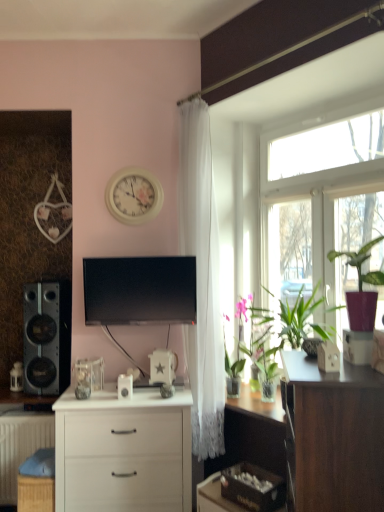
Question: From a real-world perspective, is matte purple pot at right on black glossy tv at center?

Choices:
 (A) yes
 (B) no

Answer: (A)

Question: Is matte purple pot at right thinner than black glossy tv at center?

Choices:
 (A) yes
 (B) no

Answer: (A)

Question: From the image's perspective, is matte purple pot at right beneath black glossy tv at center?

Choices:
 (A) yes
 (B) no

Answer: (B)

Question: Does matte purple pot at right have a larger size compared to black glossy tv at center?

Choices:
 (A) yes
 (B) no

Answer: (B)

Question: Does matte purple pot at right contain black glossy tv at center?

Choices:
 (A) no
 (B) yes

Answer: (A)

Question: From the image's perspective, relative to white matte radiator at lower left, is white glossy clock at upper center above or below?

Choices:
 (A) below
 (B) above

Answer: (B)

Question: Based on their sizes in the image, would you say white glossy clock at upper center is bigger or smaller than white matte radiator at lower left?

Choices:
 (A) small
 (B) big

Answer: (A)

Question: Considering the positions of white glossy clock at upper center and white matte radiator at lower left in the image, is white glossy clock at upper center taller or shorter than white matte radiator at lower left?

Choices:
 (A) short
 (B) tall

Answer: (A)

Question: Is white glossy clock at upper center wider or thinner than white matte radiator at lower left?

Choices:
 (A) thin
 (B) wide

Answer: (A)

Question: Is white matte chest of drawers at center in front of or behind black glossy tv at center in the image?

Choices:
 (A) behind
 (B) front

Answer: (B)

Question: Would you say white matte chest of drawers at center is to the left or to the right of black glossy tv at center in the picture?

Choices:
 (A) right
 (B) left

Answer: (B)

Question: Is point (147, 473) closer or farther from the camera than point (177, 258)?

Choices:
 (A) farther
 (B) closer

Answer: (B)

Question: Would you say white matte chest of drawers at center is inside or outside black glossy tv at center?

Choices:
 (A) inside
 (B) outside

Answer: (B)

Question: Considering the positions of point (175, 471) and point (317, 251), is point (175, 471) closer or farther from the camera than point (317, 251)?

Choices:
 (A) closer
 (B) farther

Answer: (A)

Question: Looking at the image, does white matte chest of drawers at center seem bigger or smaller compared to transparent glass window at upper right?

Choices:
 (A) big
 (B) small

Answer: (B)